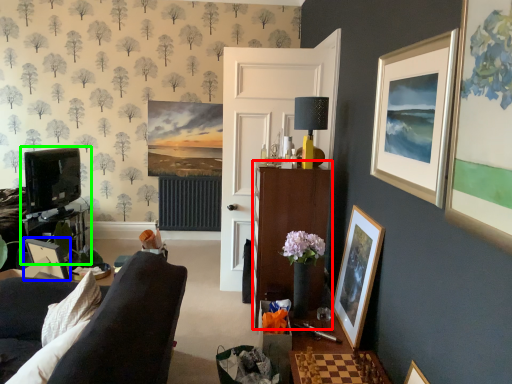
Question: Based on their relative distances, which object is farther from cabinetry (highlighted by a red box)? Choose from picture frame (highlighted by a blue box) and entertainment center (highlighted by a green box).

Choices:
 (A) picture frame
 (B) entertainment center

Answer: (B)